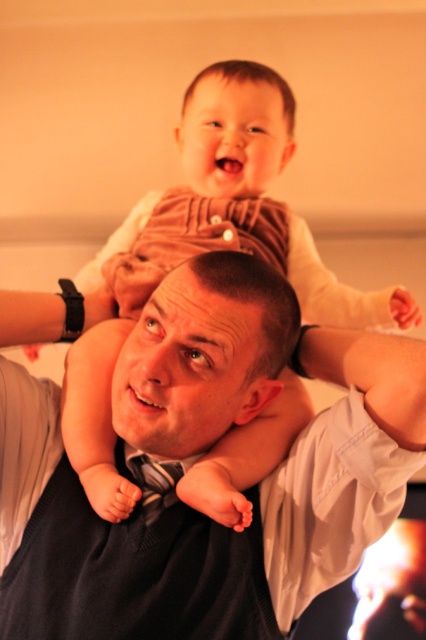
Is point (101, 340) closer to camera compared to point (160, 506)?

No, it is behind (160, 506).

Between brown corduroy pants at upper center and silky black tie at center, which one has more height?

Standing taller between the two is brown corduroy pants at upper center.

Find the location of a particular element. brown corduroy pants at upper center is located at coordinates (204, 250).

Who is lower down, matte black shirt at center or brown corduroy pants at upper center?

matte black shirt at center

Is matte black shirt at center wider than brown corduroy pants at upper center?

No, matte black shirt at center is not wider than brown corduroy pants at upper center.

The image size is (426, 640). What do you see at coordinates (209, 518) in the screenshot? I see `matte black shirt at center` at bounding box center [209, 518].

Where is `matte black shirt at center`? The image size is (426, 640). matte black shirt at center is located at coordinates [209, 518].

From the picture: Is matte black shirt at center smaller than silky black tie at center?

Incorrect, matte black shirt at center is not smaller in size than silky black tie at center.

Who is more distant from viewer, (405, 460) or (152, 461)?

The point (152, 461) is behind.

Find the location of a particular element. matte black shirt at center is located at coordinates (209, 518).